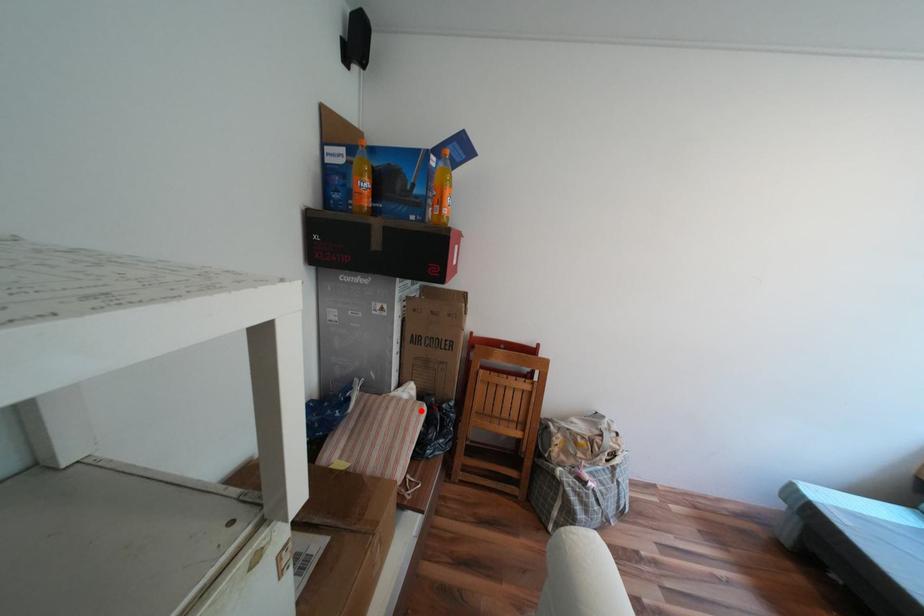
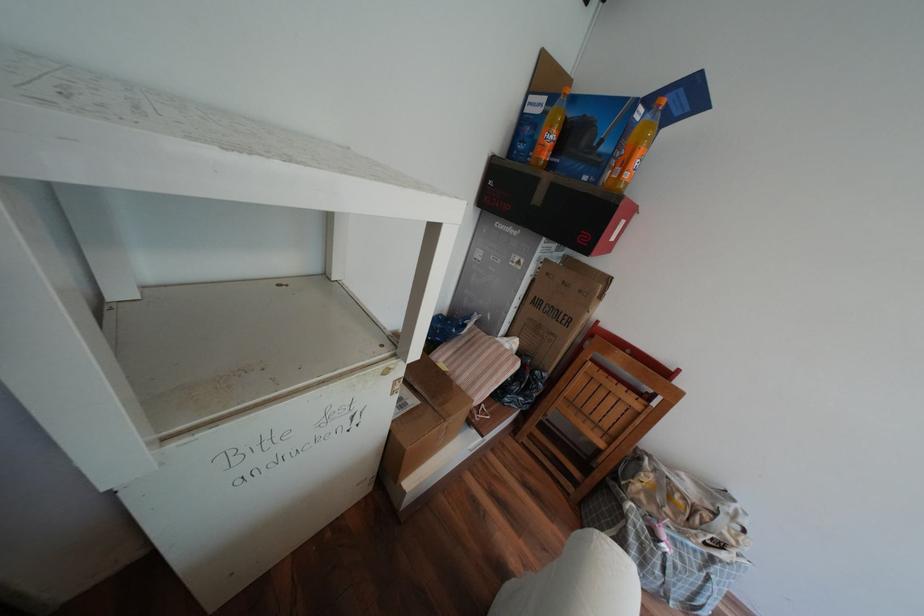
Where in the second image is the point corresponding to the highlighted location from the first image?

(517, 360)